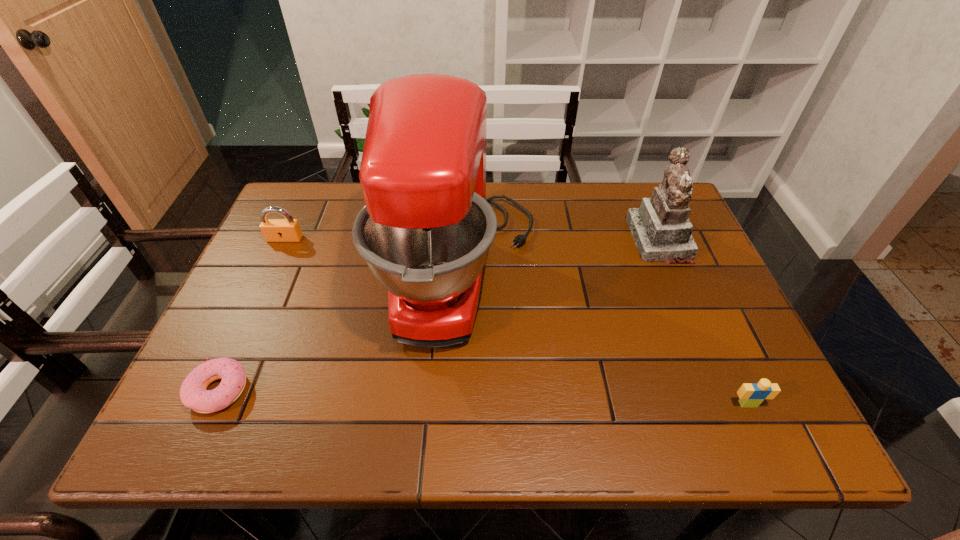
Identify the location of vacant space that satisfies the following two spatial constraints: 1. to unlock the padlock from the front; 2. on the left side of the doughnut. (214, 390).

Find the location of a particular element. The height and width of the screenshot is (540, 960). free space that satisfies the following two spatial constraints: 1. to unlock the padlock from the front; 2. on the left side of the shortest object is located at coordinates (214, 390).

You are a GUI agent. You are given a task and a screenshot of the screen. Output one action in this format:
    pyautogui.click(x=<x>, y=<y>)
    Task: Click on the free location that satisfies the following two spatial constraints: 1. on the front-facing side of the second tallest object; 2. on the front side of the shortest object
    This screenshot has width=960, height=540.
    Given the screenshot: What is the action you would take?
    pyautogui.click(x=723, y=390)

Locate an element on the screen. This screenshot has height=540, width=960. vacant space that satisfies the following two spatial constraints: 1. on the front-facing side of the second tallest object; 2. on the front side of the doughnut is located at coordinates click(x=723, y=390).